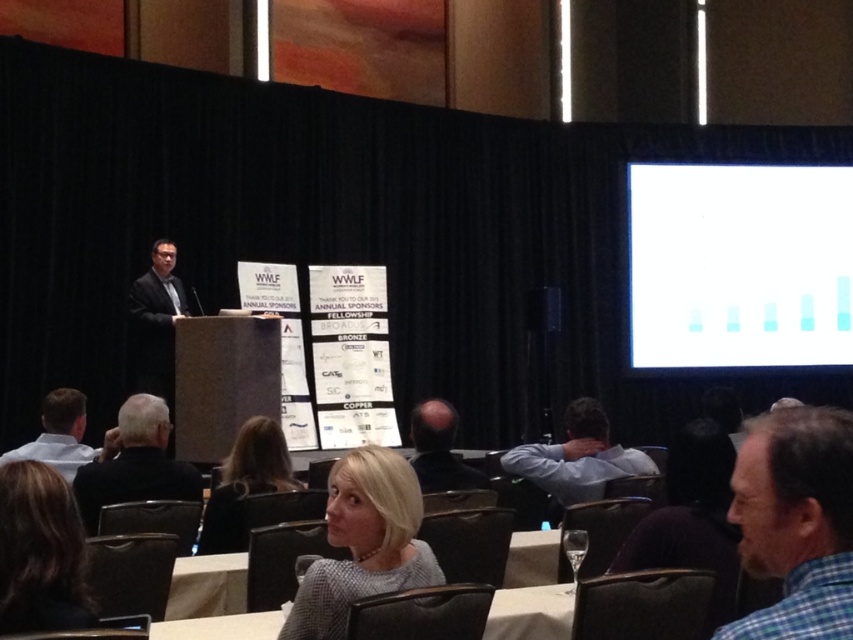
Question: Estimate the real-world distances between objects in this image. Which object is closer to the white shirt at lower left?

Choices:
 (A) smooth bald head at center
 (B) black fabric jacket at lower left

Answer: (B)

Question: Is blonde hair at center positioned at the back of white shirt at lower left?

Choices:
 (A) yes
 (B) no

Answer: (B)

Question: Which point is closer to the camera?

Choices:
 (A) smooth bald head at center
 (B) blonde hair at center
 (C) black fabric jacket at lower left
 (D) light blue shirt at center

Answer: (B)

Question: Does blue plaid shirt at lower right have a lesser width compared to blonde hair at lower left?

Choices:
 (A) no
 (B) yes

Answer: (B)

Question: From the image, what is the correct spatial relationship of blonde hair at lower left in relation to blonde hair at center?

Choices:
 (A) left
 (B) right

Answer: (A)

Question: Which object is farther from the camera taking this photo?

Choices:
 (A) white matte graph at upper right
 (B) dark gray suit at center
 (C) blonde hair at lower left

Answer: (A)